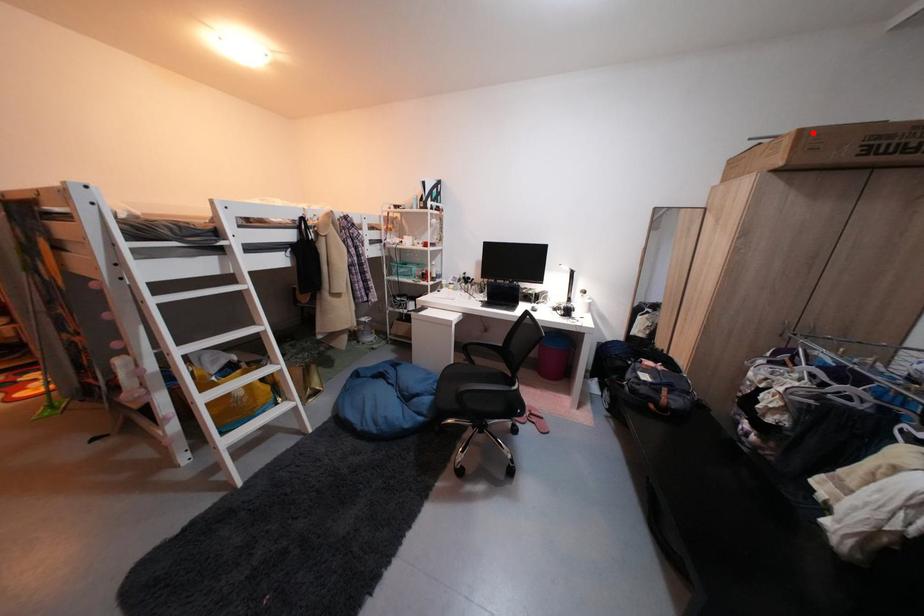
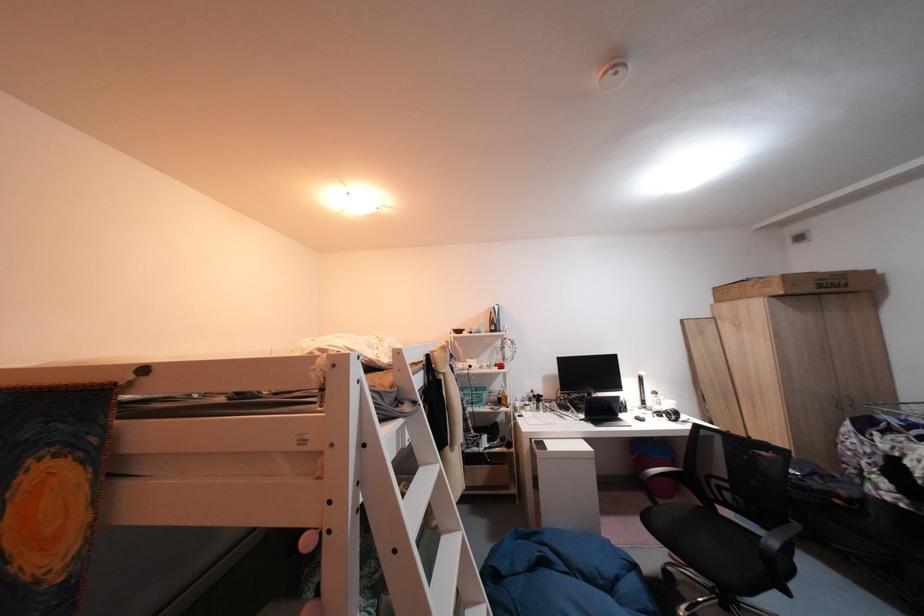
Locate, in the second image, the point that corresponds to the highlighted location in the first image.

(794, 278)